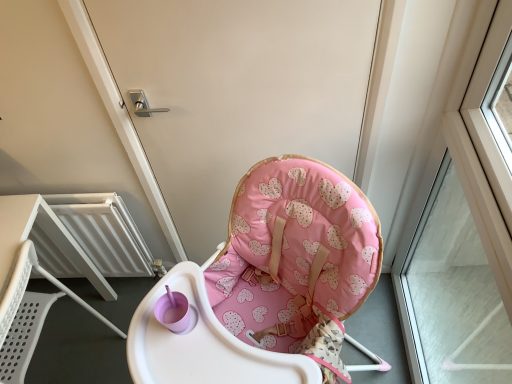
Locate an element on the screen. Image resolution: width=512 pixels, height=384 pixels. pink fabric highchair at center is located at coordinates (237, 92).

Measure the distance between pink fabric highchair at center and camera.

They are 37.46 inches apart.

You are a GUI agent. You are given a task and a screenshot of the screen. Output one action in this format:
    pyautogui.click(x=<x>, y=<y>)
    Task: Click on the white metallic radiator at left
    
    Given the screenshot: What is the action you would take?
    pyautogui.click(x=104, y=232)

In order to click on white plastic chair at lower left in this screenshot , I will do `click(29, 316)`.

The image size is (512, 384). Find the location of `screen door that is on the right side of white plastic chair at lower left`. screen door that is on the right side of white plastic chair at lower left is located at coordinates (237, 92).

Looking at this image, is pink fabric highchair at center positioned far away from white plastic chair at lower left?

They are positioned close to each other.

Who is more distant, pink fabric highchair at center or white plastic chair at lower left?

Positioned behind is white plastic chair at lower left.

From a real-world perspective, is white metallic radiator at left positioned above or below white plastic chair at lower left?

In terms of real-world spatial position, white metallic radiator at left is below white plastic chair at lower left.

Where is `chair on the left side of white metallic radiator at left`? chair on the left side of white metallic radiator at left is located at coordinates click(29, 316).

Is point (129, 272) positioned in front of point (6, 365)?

No, it is not.

How far apart are white metallic radiator at left and white plastic chair at lower left?

A distance of 10.45 inches exists between white metallic radiator at left and white plastic chair at lower left.

Is transparent glass window at right to the left or to the right of white plastic chair at lower left in the image?

In the image, transparent glass window at right appears on the right side of white plastic chair at lower left.

Which of these two, transparent glass window at right or white plastic chair at lower left, is thinner?

transparent glass window at right is thinner.

Is transparent glass window at right located outside white plastic chair at lower left?

Yes, transparent glass window at right is outside of white plastic chair at lower left.

Which object is wider, white metallic radiator at left or transparent glass window at right?

transparent glass window at right.

Which of these two, white metallic radiator at left or transparent glass window at right, is bigger?

With larger size is transparent glass window at right.

From a real-world perspective, is white metallic radiator at left located beneath transparent glass window at right?

Correct, in the physical world, white metallic radiator at left is lower than transparent glass window at right.

Is transparent glass window at right to the right of pink fabric highchair at center from the viewer's perspective?

Yes.

Are transparent glass window at right and pink fabric highchair at center located far from each other?

No, there isn't a large distance between transparent glass window at right and pink fabric highchair at center.

In the scene shown: Is transparent glass window at right taller or shorter than pink fabric highchair at center?

In the image, transparent glass window at right appears to be taller than pink fabric highchair at center.

Is transparent glass window at right bigger than pink fabric highchair at center?

Yes, transparent glass window at right is bigger than pink fabric highchair at center.

Considering the sizes of white plastic chair at lower left and pink fabric highchair at center in the image, is white plastic chair at lower left wider or thinner than pink fabric highchair at center?

Clearly, white plastic chair at lower left has more width compared to pink fabric highchair at center.

Is white plastic chair at lower left next to pink fabric highchair at center?

They are not placed beside each other.

Can you confirm if white plastic chair at lower left is taller than pink fabric highchair at center?

Incorrect, the height of white plastic chair at lower left is not larger of that of pink fabric highchair at center.

Which is correct: white plastic chair at lower left is inside pink fabric highchair at center, or outside of it?

white plastic chair at lower left lies outside pink fabric highchair at center.

Does pink fabric highchair at center turn towards transparent glass window at right?

No, pink fabric highchair at center is not turned towards transparent glass window at right.

Considering the sizes of pink fabric highchair at center and transparent glass window at right in the image, is pink fabric highchair at center bigger or smaller than transparent glass window at right?

In the image, pink fabric highchair at center appears to be smaller than transparent glass window at right.

Is pink fabric highchair at center next to transparent glass window at right and touching it?

pink fabric highchair at center and transparent glass window at right are clearly separated.

Considering the sizes of objects pink fabric highchair at center and transparent glass window at right in the image provided, who is thinner, pink fabric highchair at center or transparent glass window at right?

Thinner between the two is pink fabric highchair at center.

This screenshot has height=384, width=512. I want to click on chair on the left of the pink fabric highchair at center, so click(29, 316).

Locate an element on the screen. chair below the white metallic radiator at left (from the image's perspective) is located at coordinates (29, 316).

Based on their spatial positions, is pink fabric highchair at center or white metallic radiator at left closer to transparent glass window at right?

Among the two, pink fabric highchair at center is located nearer to transparent glass window at right.

Based on their spatial positions, is white plastic chair at lower left or pink fabric highchair at center further from white metallic radiator at left?

Based on the image, pink fabric highchair at center appears to be further to white metallic radiator at left.

Looking at the image, which one is located closer to white metallic radiator at left, transparent glass window at right or pink fabric highchair at center?

pink fabric highchair at center.

Considering their positions, is transparent glass window at right positioned closer to pink fabric highchair at center than white metallic radiator at left?

→ white metallic radiator at left is positioned closer to the anchor pink fabric highchair at center.

Based on their spatial positions, is white plastic chair at lower left or white metallic radiator at left closer to transparent glass window at right?

white metallic radiator at left lies closer to transparent glass window at right than the other object.

Considering their positions, is white plastic chair at lower left positioned further to pink fabric highchair at center than transparent glass window at right?

The object further to pink fabric highchair at center is white plastic chair at lower left.

From the image, which object appears to be nearer to white metallic radiator at left, white plastic chair at lower left or transparent glass window at right?

white plastic chair at lower left.

Based on the photo, which object lies further to the anchor point pink fabric highchair at center, white metallic radiator at left or white plastic chair at lower left?

The object further to pink fabric highchair at center is white plastic chair at lower left.

Where is `radiator between white plastic chair at lower left and pink fabric highchair at center from left to right`? Image resolution: width=512 pixels, height=384 pixels. radiator between white plastic chair at lower left and pink fabric highchair at center from left to right is located at coordinates (104, 232).

The height and width of the screenshot is (384, 512). Identify the location of screen door between white metallic radiator at left and transparent glass window at right. (237, 92).

Where is `screen door situated between white plastic chair at lower left and transparent glass window at right from left to right`? This screenshot has height=384, width=512. screen door situated between white plastic chair at lower left and transparent glass window at right from left to right is located at coordinates (237, 92).

Image resolution: width=512 pixels, height=384 pixels. What are the coordinates of `radiator between white plastic chair at lower left and transparent glass window at right from left to right` in the screenshot? It's located at (104, 232).